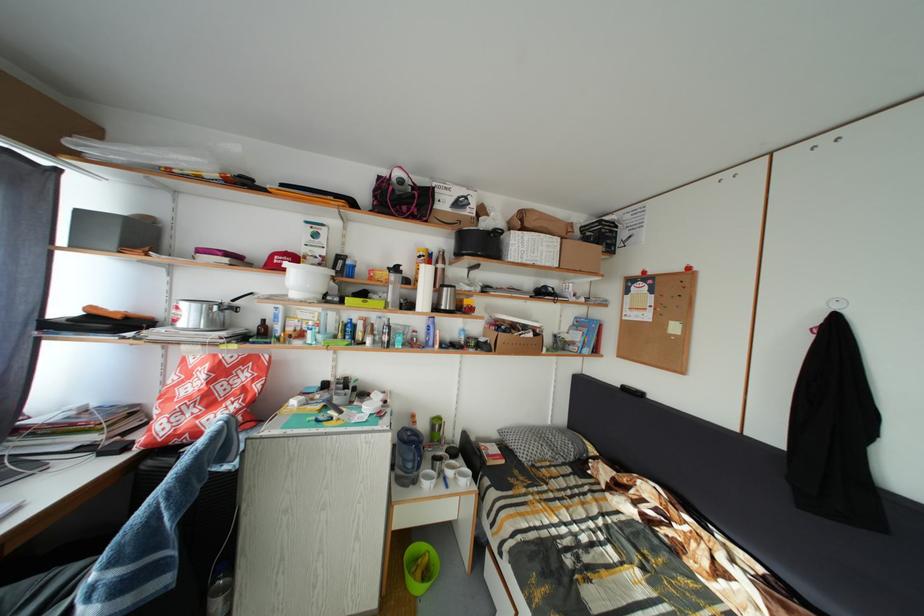
The image size is (924, 616). What do you see at coordinates (837, 302) in the screenshot?
I see `the white wall hook` at bounding box center [837, 302].